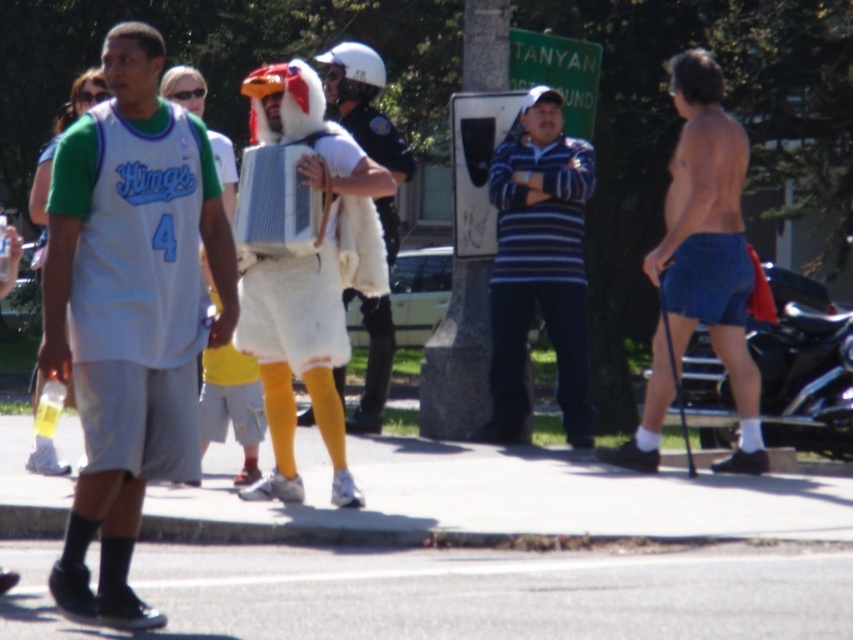
Question: Considering the real-world distances, which object is farthest from the denim shorts at right?

Choices:
 (A) blue striped shirt at center
 (B) fuzzy white costume at center

Answer: (B)

Question: Can you confirm if blue striped shirt at center is positioned above fuzzy white costume at center?

Choices:
 (A) yes
 (B) no

Answer: (B)

Question: Which object is closer to the camera taking this photo?

Choices:
 (A) white fluffy costume at center
 (B) white jersey at center
 (C) denim shorts at right
 (D) blue striped shirt at center

Answer: (B)

Question: Which object is the closest to the blue striped shirt at center?

Choices:
 (A) white fluffy costume at center
 (B) white jersey at center
 (C) denim shorts at right
 (D) fuzzy white costume at center

Answer: (D)

Question: Is white fluffy costume at center thinner than blue striped shirt at center?

Choices:
 (A) no
 (B) yes

Answer: (A)

Question: Where is white fluffy costume at center located in relation to blue striped shirt at center in the image?

Choices:
 (A) right
 (B) left

Answer: (B)